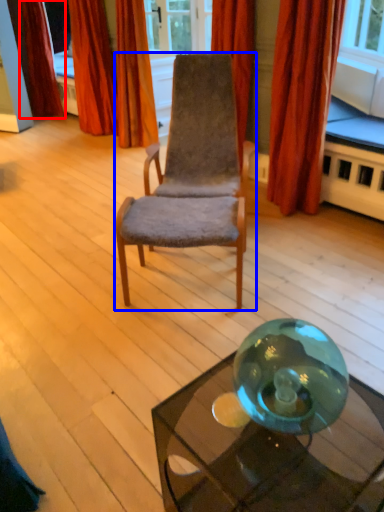
Question: Among these objects, which one is nearest to the camera, curtain (highlighted by a red box) or chair (highlighted by a blue box)?

Choices:
 (A) curtain
 (B) chair

Answer: (B)